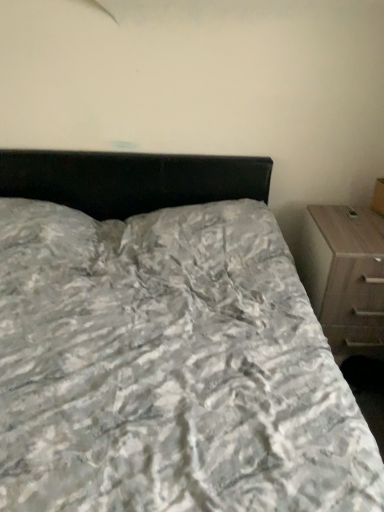
Question: Does wooden chest of drawers at right have a greater width compared to textured gray bedspread at center?

Choices:
 (A) yes
 (B) no

Answer: (B)

Question: Would you say wooden chest of drawers at right contains textured gray bedspread at center?

Choices:
 (A) yes
 (B) no

Answer: (B)

Question: Is wooden chest of drawers at right shorter than textured gray bedspread at center?

Choices:
 (A) no
 (B) yes

Answer: (B)

Question: Considering the relative sizes of wooden chest of drawers at right and textured gray bedspread at center in the image provided, is wooden chest of drawers at right bigger than textured gray bedspread at center?

Choices:
 (A) no
 (B) yes

Answer: (A)

Question: Is wooden chest of drawers at right further to the viewer compared to textured gray bedspread at center?

Choices:
 (A) no
 (B) yes

Answer: (B)

Question: Considering the relative sizes of wooden chest of drawers at right and textured gray bedspread at center in the image provided, is wooden chest of drawers at right thinner than textured gray bedspread at center?

Choices:
 (A) no
 (B) yes

Answer: (B)

Question: Does textured gray bedspread at center have a smaller size compared to wooden chest of drawers at right?

Choices:
 (A) yes
 (B) no

Answer: (B)

Question: Is textured gray bedspread at center looking in the opposite direction of wooden chest of drawers at right?

Choices:
 (A) yes
 (B) no

Answer: (B)

Question: From a real-world perspective, is textured gray bedspread at center under wooden chest of drawers at right?

Choices:
 (A) yes
 (B) no

Answer: (B)

Question: Is textured gray bedspread at center placed right next to wooden chest of drawers at right?

Choices:
 (A) yes
 (B) no

Answer: (B)

Question: Would you say wooden chest of drawers at right is part of textured gray bedspread at center's contents?

Choices:
 (A) yes
 (B) no

Answer: (B)

Question: From the image's perspective, would you say textured gray bedspread at center is shown under wooden chest of drawers at right?

Choices:
 (A) yes
 (B) no

Answer: (A)

Question: From the image's perspective, is wooden chest of drawers at right positioned above or below textured gray bedspread at center?

Choices:
 (A) below
 (B) above

Answer: (B)